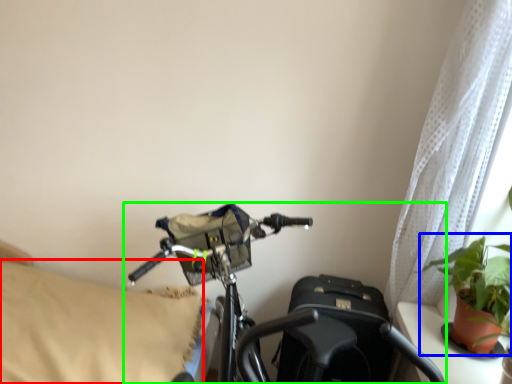
Question: Which object is positioned closest to pillow (highlighted by a red box)? Select from houseplant (highlighted by a blue box) and bicycle (highlighted by a green box).

Choices:
 (A) houseplant
 (B) bicycle

Answer: (B)